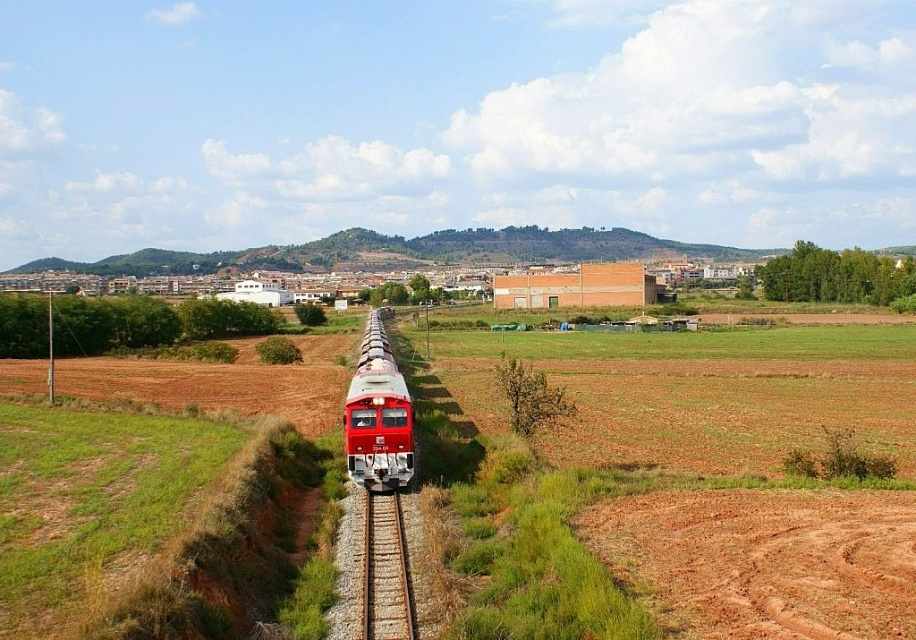
Question: Can you confirm if red clay dirt track at lower right is positioned below rusty metal train track at center?

Choices:
 (A) no
 (B) yes

Answer: (A)

Question: Among these points, which one is farthest from the camera?

Choices:
 (A) (369, 556)
 (B) (810, 627)

Answer: (A)

Question: Among these objects, which one is farthest from the camera?

Choices:
 (A) rusty metal train track at center
 (B) red clay dirt track at lower right
 (C) matte red train at center

Answer: (C)

Question: Can you confirm if rusty metal train track at center is positioned above matte red train at center?

Choices:
 (A) yes
 (B) no

Answer: (B)

Question: Can you confirm if red clay dirt track at lower right is wider than rusty metal train track at center?

Choices:
 (A) yes
 (B) no

Answer: (A)

Question: Which object appears closest to the camera in this image?

Choices:
 (A) red clay dirt track at lower right
 (B) matte red train at center
 (C) rusty metal train track at center

Answer: (A)